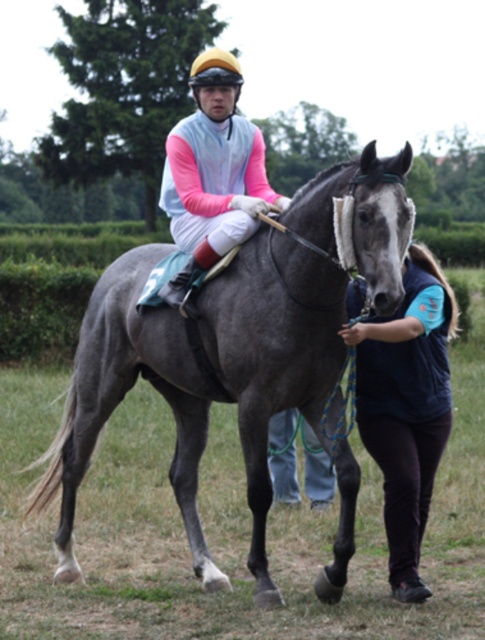
Question: Which of the following is the closest to the observer?

Choices:
 (A) dark blue fleece vest at lower right
 (B) gray glossy horse at center

Answer: (B)

Question: Which is nearer to the dark blue fleece vest at lower right?

Choices:
 (A) gray glossy horse at center
 (B) matte pink jersey at center

Answer: (A)

Question: Where is dark blue fleece vest at lower right located in relation to matte pink jersey at center in the image?

Choices:
 (A) right
 (B) left

Answer: (A)

Question: Which of the following is the farthest from the observer?

Choices:
 (A) (216, 124)
 (B) (417, 420)
 (C) (320, 208)

Answer: (A)

Question: Where is gray glossy horse at center located in relation to matte pink jersey at center in the image?

Choices:
 (A) right
 (B) left

Answer: (A)

Question: Does dark blue fleece vest at lower right appear over matte pink jersey at center?

Choices:
 (A) yes
 (B) no

Answer: (B)